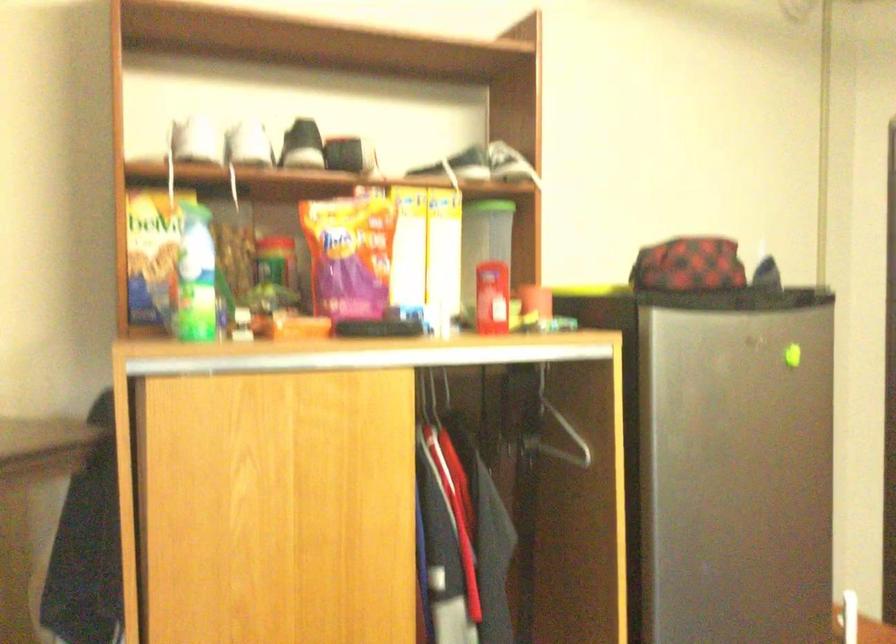
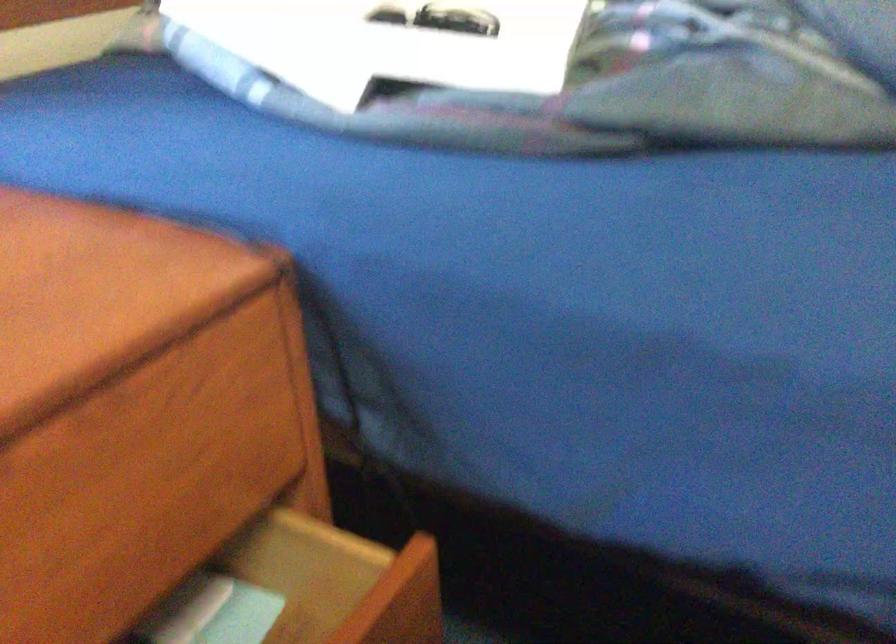
First-person continuous shooting, in which direction is the camera rotating?

The camera's rotation is toward left-down.